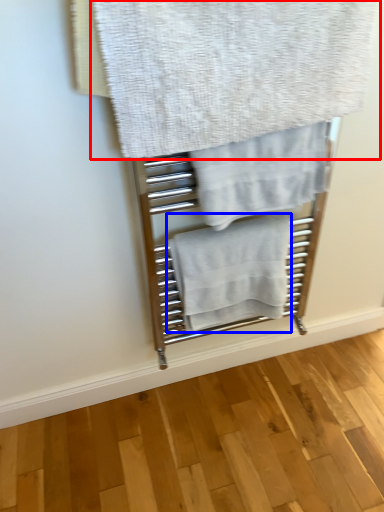
Question: Which of the following is the closest to the observer, towel (highlighted by a red box) or towel (highlighted by a blue box)?

Choices:
 (A) towel
 (B) towel

Answer: (A)